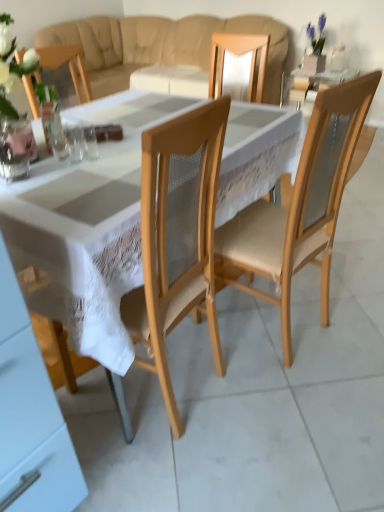
Question: Considering the positions of beige fabric couch at upper center and white glossy cabinet at lower left in the image, is beige fabric couch at upper center bigger or smaller than white glossy cabinet at lower left?

Choices:
 (A) small
 (B) big

Answer: (B)

Question: Considering the positions of point (112, 39) and point (43, 463), is point (112, 39) closer or farther from the camera than point (43, 463)?

Choices:
 (A) closer
 (B) farther

Answer: (B)

Question: Estimate the real-world distances between objects in this image. Which object is closer to the clear glass vase at lower left?

Choices:
 (A) beige fabric couch at upper center
 (B) natural wood chair at center
 (C) white lace tablecloth at center
 (D) clear glass at center, which is counted as the third tableware, starting from the right
 (E) clear glass cup at center, positioned as the 1th tableware in right-to-left order

Answer: (D)

Question: Estimate the real-world distances between objects in this image. Which object is closer to the beige fabric couch at upper center?

Choices:
 (A) clear glass cup at center, positioned as the 1th tableware in right-to-left order
 (B) clear glass vase at lower left
 (C) natural wood chair at center
 (D) clear glass at center, which ranks as the 2th tableware in right-to-left order
 (E) clear glass at center, which is counted as the third tableware, starting from the right

Answer: (C)